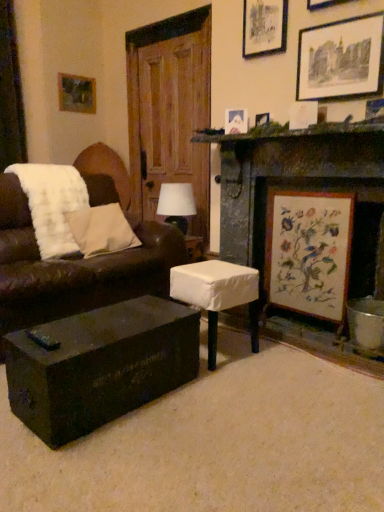
The height and width of the screenshot is (512, 384). In order to click on vacant area that lies to the right of white fabric-covered stool at center in this screenshot , I will do [278, 355].